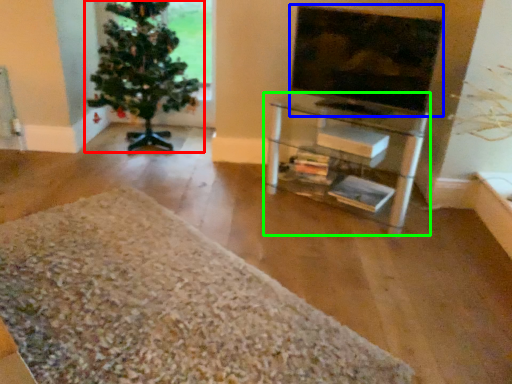
Question: Based on their relative distances, which object is nearer to houseplant (highlighted by a red box)? Choose from television (highlighted by a blue box) and shelf (highlighted by a green box).

Choices:
 (A) television
 (B) shelf

Answer: (B)